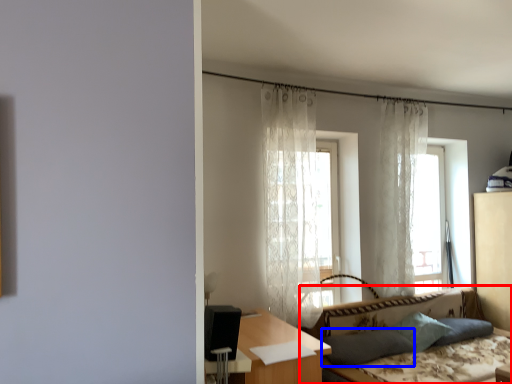
Question: Which point is closer to the camera, studio couch (highlighted by a red box) or pillow (highlighted by a blue box)?

Choices:
 (A) studio couch
 (B) pillow

Answer: (A)